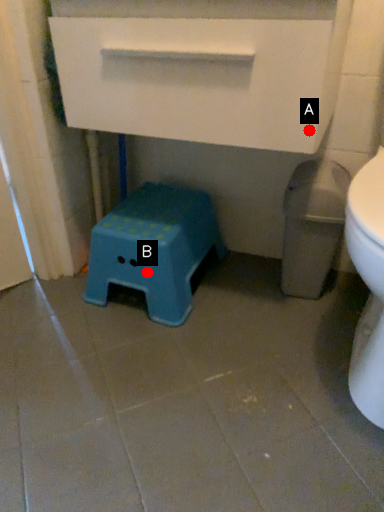
Question: Two points are circled on the image, labeled by A and B beside each circle. Among these points, which one is nearest to the camera?

Choices:
 (A) A is closer
 (B) B is closer

Answer: (A)